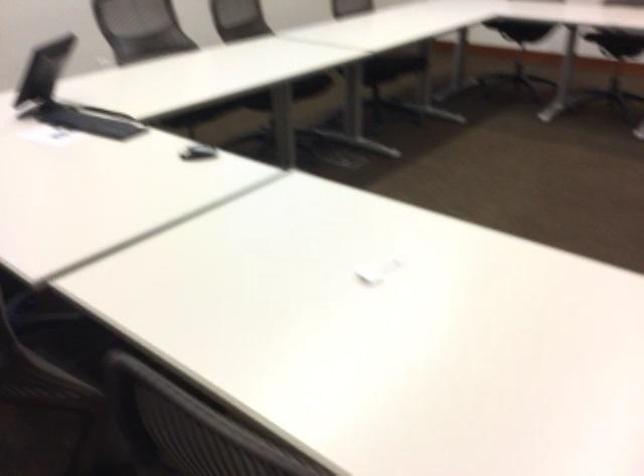
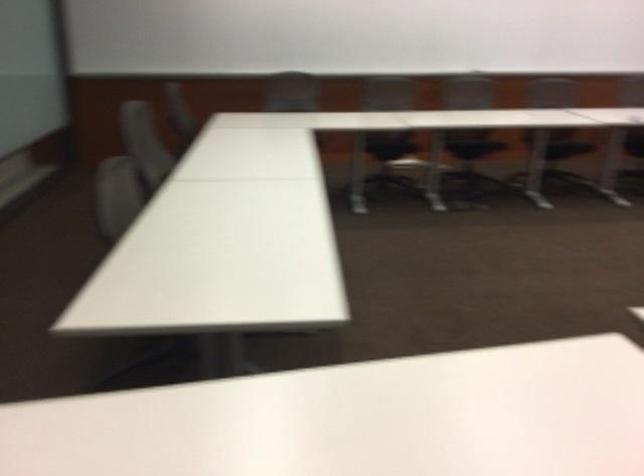
Question: What movement of the cameraman would produce the second image?

Choices:
 (A) Left
 (B) Right
 (C) Forward
 (D) Backward

Answer: (D)